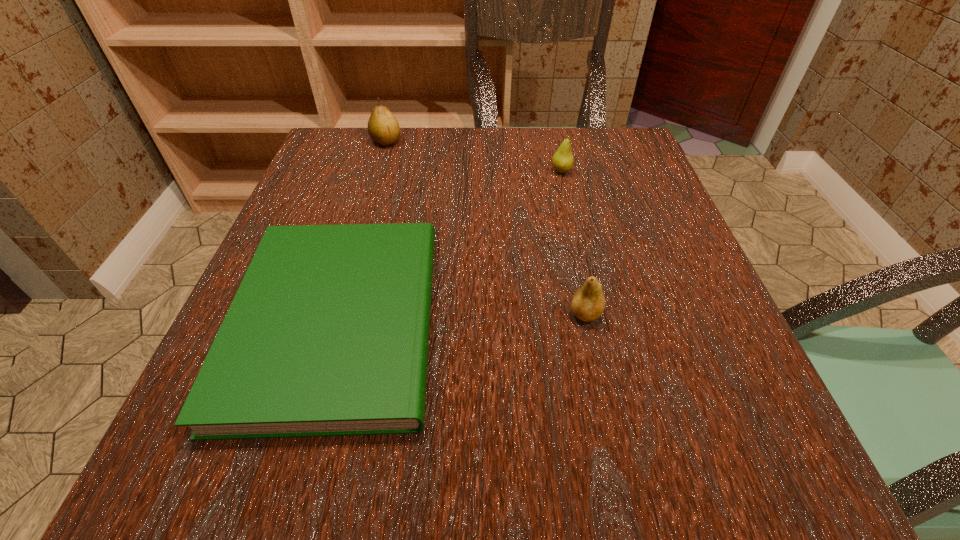
Where is `the farthest object`? the farthest object is located at coordinates (383, 128).

Find the location of a particular element. This screenshot has height=540, width=960. the farthest pear is located at coordinates (383, 128).

What are the coordinates of `the second farthest object` in the screenshot? It's located at (562, 160).

Locate an element on the screen. The height and width of the screenshot is (540, 960). the nearest pear is located at coordinates (588, 303).

Locate an element on the screen. This screenshot has width=960, height=540. the shortest object is located at coordinates (328, 333).

Image resolution: width=960 pixels, height=540 pixels. Identify the location of vacant area located 0.310m on the right of the leftmost pear. (531, 141).

The height and width of the screenshot is (540, 960). I want to click on vacant position located on the left of the second farthest pear, so click(419, 171).

Where is `vacant space situated 0.130m on the front of the nearest pear`? The height and width of the screenshot is (540, 960). vacant space situated 0.130m on the front of the nearest pear is located at coordinates (605, 406).

Locate an element on the screen. The height and width of the screenshot is (540, 960). vacant space located on the right of the paperback book is located at coordinates (663, 321).

At what (x,y) coordinates should I click in order to perform the action: click on object at the near edge. Please return your answer as a coordinate pair (x, y). Looking at the image, I should click on (328, 333).